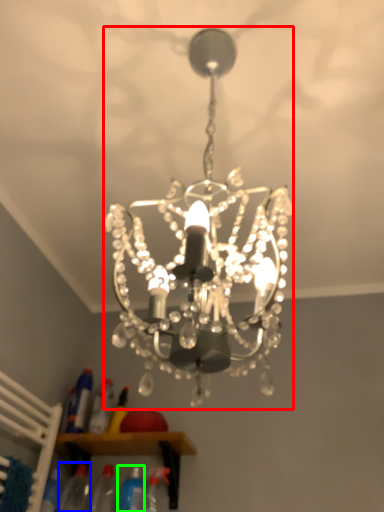
Question: Which object is positioned closest to lamp (highlighted by a red box)? Select from bottle (highlighted by a blue box) and bottle (highlighted by a green box).

Choices:
 (A) bottle
 (B) bottle

Answer: (B)